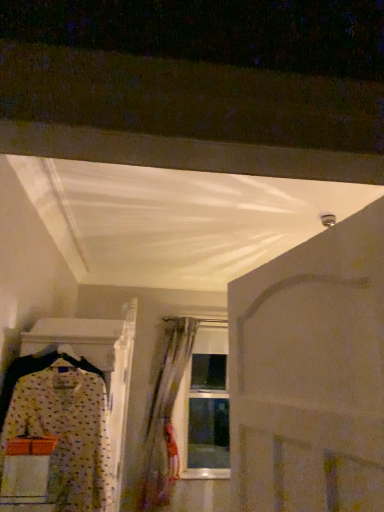
Question: Is white matte door at center in contact with translucent fabric curtain at center?

Choices:
 (A) no
 (B) yes

Answer: (A)

Question: Considering the relative positions of white matte door at center and translucent fabric curtain at center in the image provided, is white matte door at center behind translucent fabric curtain at center?

Choices:
 (A) yes
 (B) no

Answer: (B)

Question: Is white matte door at center positioned in front of translucent fabric curtain at center?

Choices:
 (A) yes
 (B) no

Answer: (A)

Question: Does white matte door at center appear on the left side of translucent fabric curtain at center?

Choices:
 (A) no
 (B) yes

Answer: (A)

Question: Is white matte door at center oriented towards translucent fabric curtain at center?

Choices:
 (A) no
 (B) yes

Answer: (A)

Question: Is point (160, 415) closer or farther from the camera than point (46, 416)?

Choices:
 (A) farther
 (B) closer

Answer: (A)

Question: From a real-world perspective, is translucent fabric curtain at center positioned above or below polka dot fabric dress at left?

Choices:
 (A) below
 (B) above

Answer: (A)

Question: In terms of height, does translucent fabric curtain at center look taller or shorter compared to polka dot fabric dress at left?

Choices:
 (A) tall
 (B) short

Answer: (A)

Question: Is translucent fabric curtain at center to the left or to the right of polka dot fabric dress at left in the image?

Choices:
 (A) left
 (B) right

Answer: (B)

Question: From a real-world perspective, is polka dot fabric dress at left above or below translucent fabric curtain at center?

Choices:
 (A) above
 (B) below

Answer: (A)

Question: Do you think polka dot fabric dress at left is within translucent fabric curtain at center, or outside of it?

Choices:
 (A) inside
 (B) outside

Answer: (B)

Question: Relative to translucent fabric curtain at center, is polka dot fabric dress at left in front or behind?

Choices:
 (A) behind
 (B) front

Answer: (B)

Question: From the image's perspective, is polka dot fabric dress at left located above or below translucent fabric curtain at center?

Choices:
 (A) above
 (B) below

Answer: (A)

Question: From the image's perspective, is translucent fabric curtain at center above or below white matte door at center?

Choices:
 (A) below
 (B) above

Answer: (A)

Question: Is translucent fabric curtain at center bigger or smaller than white matte door at center?

Choices:
 (A) small
 (B) big

Answer: (B)